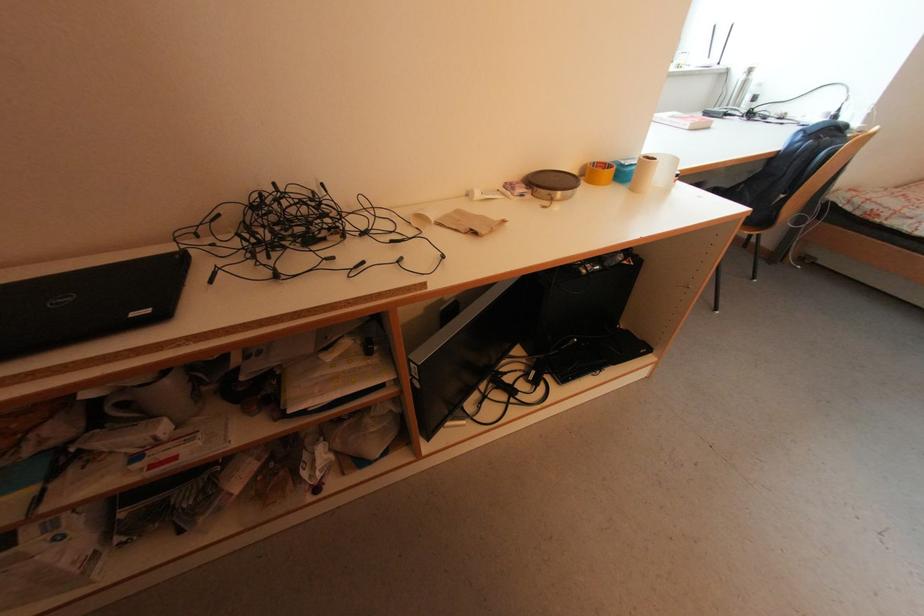
Where is `black closed laptop`? black closed laptop is located at coordinates (101, 292).